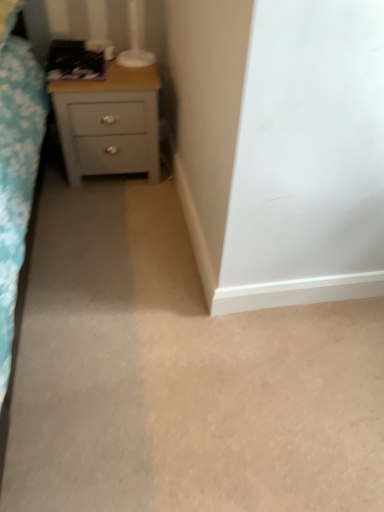
Measure the distance between matte gray chest of drawers at left and camera.

The distance of matte gray chest of drawers at left from camera is 1.74 meters.

What do you see at coordinates (109, 122) in the screenshot? I see `matte gray chest of drawers at left` at bounding box center [109, 122].

Locate an element on the screen. Image resolution: width=384 pixels, height=512 pixels. matte gray chest of drawers at left is located at coordinates (109, 122).

You are a GUI agent. You are given a task and a screenshot of the screen. Output one action in this format:
    pyautogui.click(x=<x>, y=<y>)
    Task: Click on the matte gray chest of drawers at left
    The image size is (384, 512).
    Given the screenshot: What is the action you would take?
    pyautogui.click(x=109, y=122)